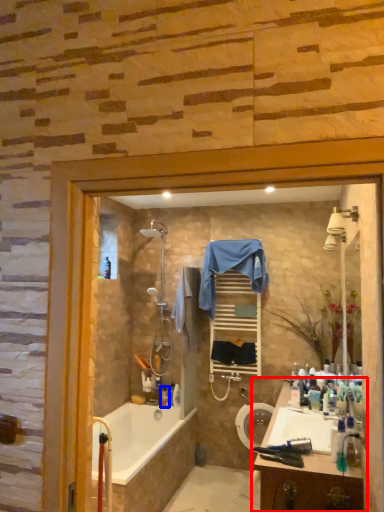
Question: Which of the following is the closest to the observer, bathroom cabinet (highlighted by a red box) or toiletry (highlighted by a blue box)?

Choices:
 (A) bathroom cabinet
 (B) toiletry

Answer: (A)